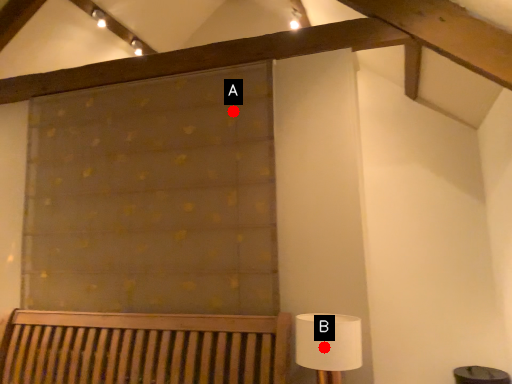
Question: Two points are circled on the image, labeled by A and B beside each circle. Among these points, which one is nearest to the camera?

Choices:
 (A) A is closer
 (B) B is closer

Answer: (B)